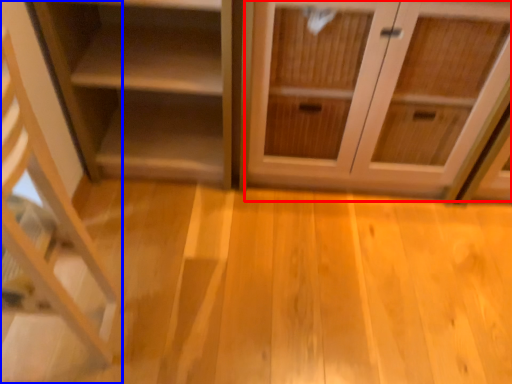
Question: Which of the following is the farthest to the observer, cabinetry (highlighted by a red box) or shelf (highlighted by a blue box)?

Choices:
 (A) cabinetry
 (B) shelf

Answer: (A)